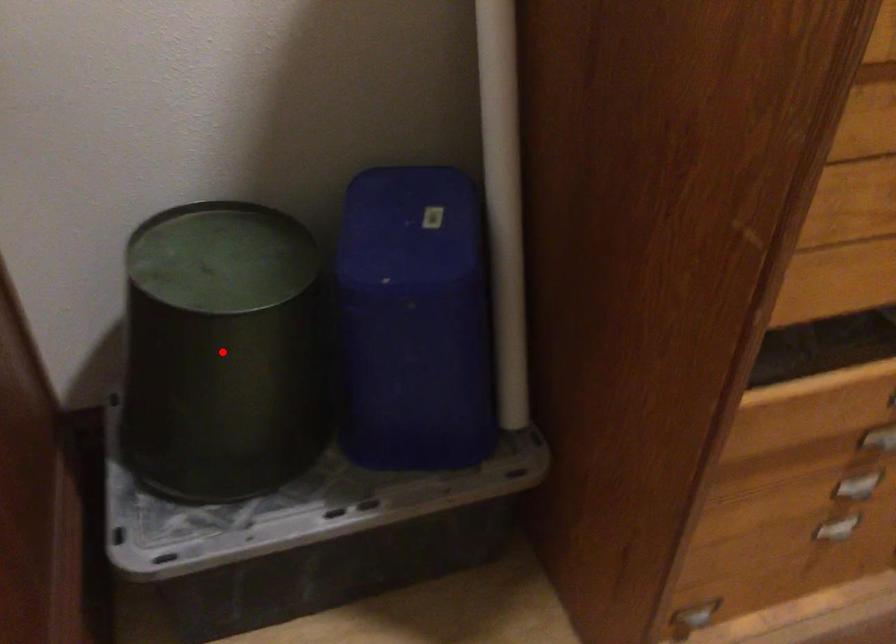
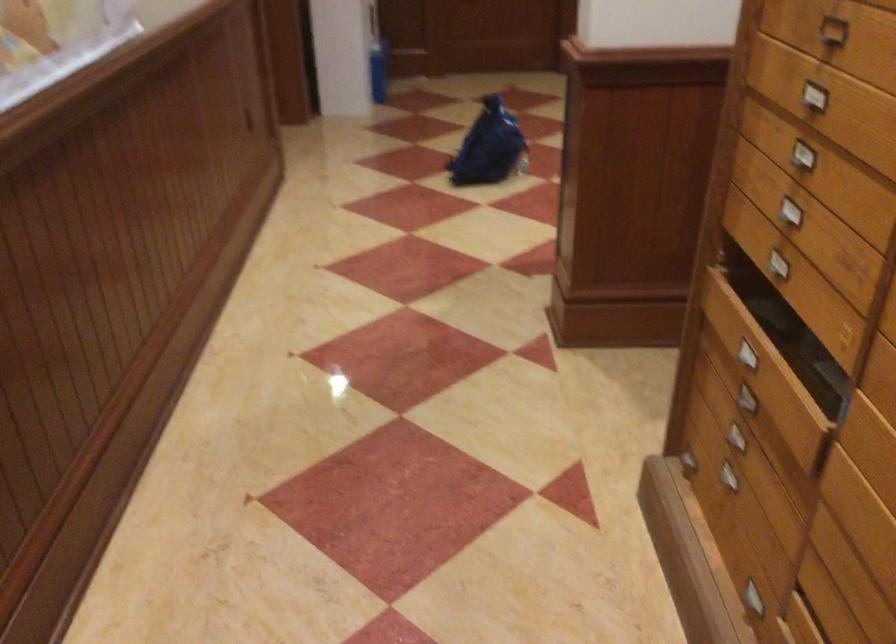
Question: I am providing you with two images of the same scene from different viewpoints. A red point is marked on the first image. At the location where the point appears in image 1, is it still visible in image 2?

Choices:
 (A) Yes
 (B) No

Answer: (B)